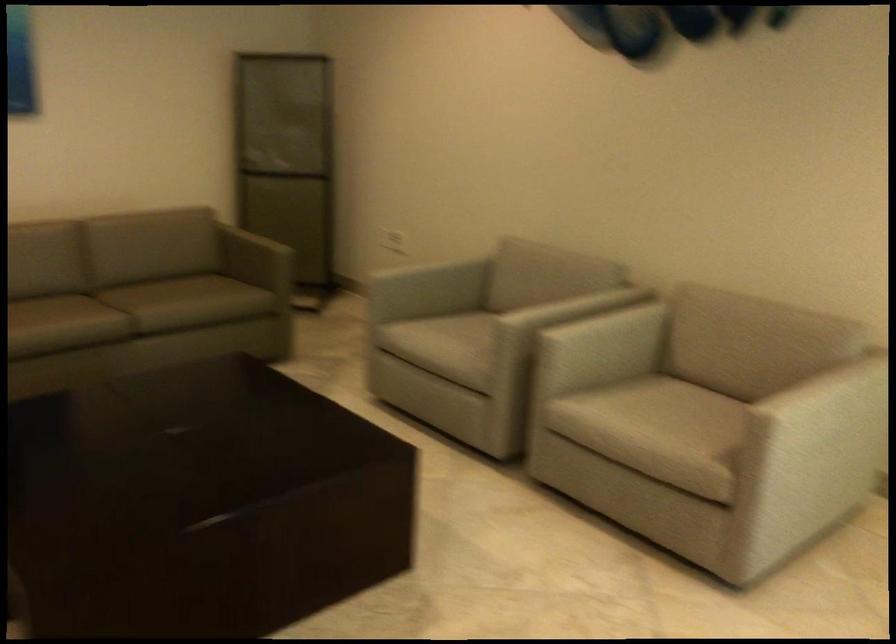
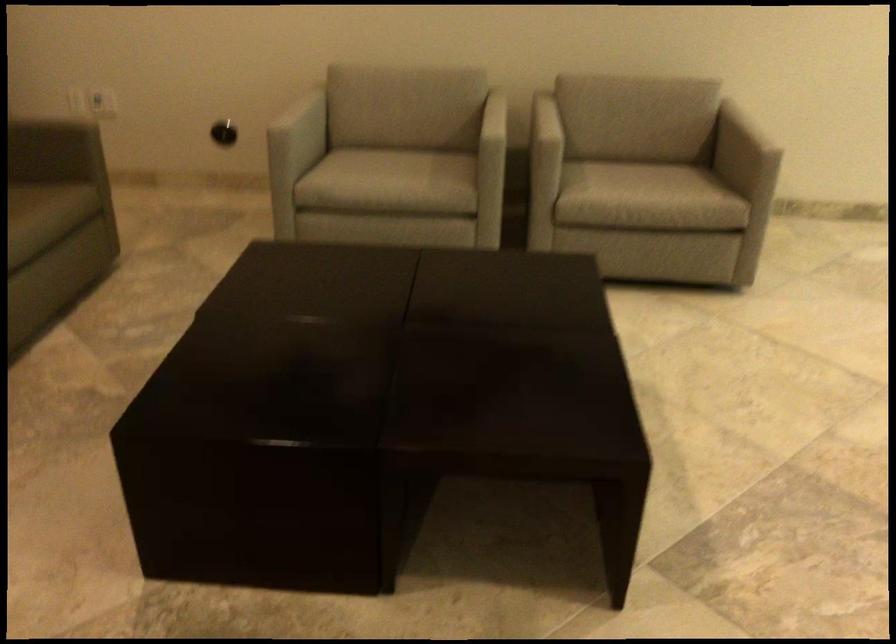
Where in the second image is the point corresponding to point 444,343 from the first image?

(390, 176)